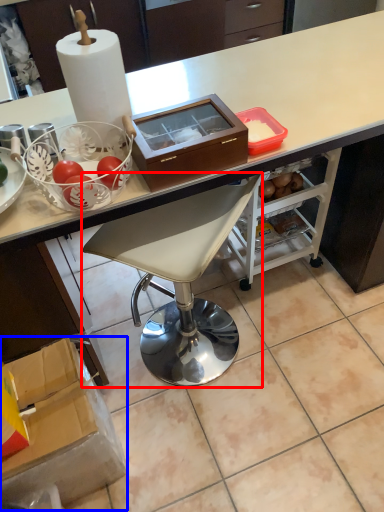
Question: Which of the following is the farthest to the observer, chair (highlighted by a red box) or box (highlighted by a blue box)?

Choices:
 (A) chair
 (B) box

Answer: (B)